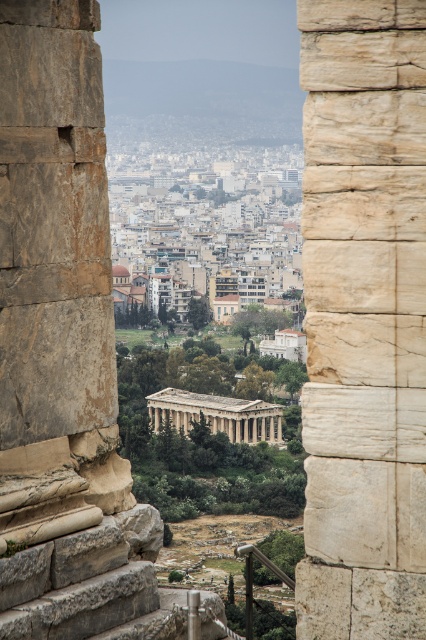
Can you confirm if white stone column at center is taller than beige stone temple at center?

Correct, white stone column at center is much taller as beige stone temple at center.

Is white stone column at center thinner than beige stone temple at center?

Yes, white stone column at center is thinner than beige stone temple at center.

Which is behind, point (350, 96) or point (222, 413)?

Positioned behind is point (222, 413).

What are the coordinates of `white stone column at center` in the screenshot? It's located at (363, 320).